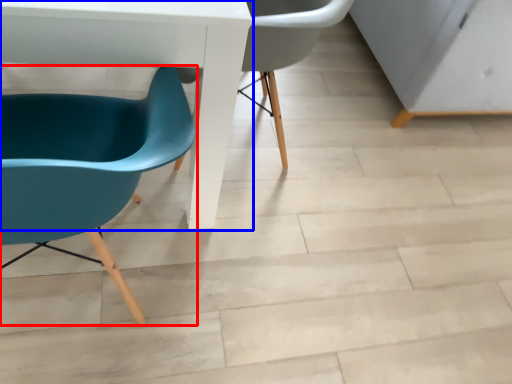
Question: Which object appears farthest to the camera in this image, chair (highlighted by a red box) or table (highlighted by a blue box)?

Choices:
 (A) chair
 (B) table

Answer: (B)